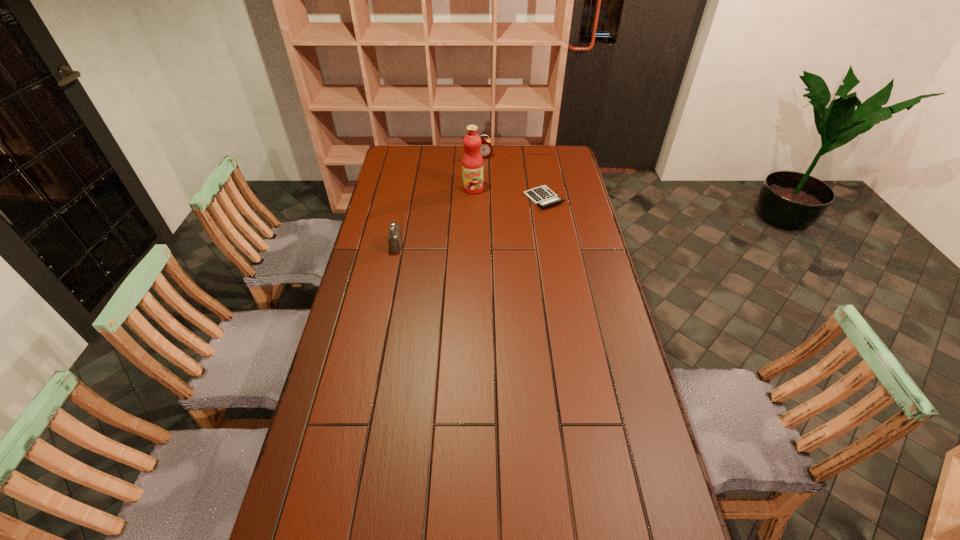
Where is `free location located 0.120m on the front-facing side of the alarm clock`? free location located 0.120m on the front-facing side of the alarm clock is located at coordinates (487, 172).

Where is `vacant position located on the front-facing side of the alarm clock`? This screenshot has width=960, height=540. vacant position located on the front-facing side of the alarm clock is located at coordinates point(493,206).

The width and height of the screenshot is (960, 540). I want to click on vacant space positioned 0.100m on the front-facing side of the alarm clock, so click(487, 170).

Find the location of a particular element. vacant space located 0.100m on the front label of the fruit juice is located at coordinates [471, 208].

The image size is (960, 540). In order to click on free space located 0.290m on the front label of the fruit juice in this screenshot , I will do `click(468, 236)`.

Find the location of `vacant region located on the front label of the fruit juice`. vacant region located on the front label of the fruit juice is located at coordinates (469, 230).

I want to click on object that is at the far edge, so click(486, 149).

This screenshot has height=540, width=960. I want to click on object that is positioned at the left edge, so click(x=395, y=239).

Where is `object that is at the right edge`? The height and width of the screenshot is (540, 960). object that is at the right edge is located at coordinates (542, 196).

The width and height of the screenshot is (960, 540). Identify the location of free space at the far edge. (433, 167).